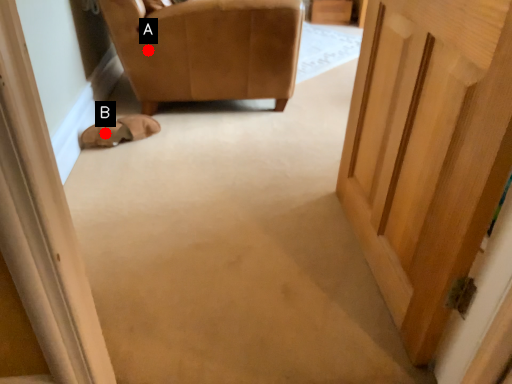
Question: Two points are circled on the image, labeled by A and B beside each circle. Which point is further to the camera?

Choices:
 (A) A is further
 (B) B is further

Answer: (A)